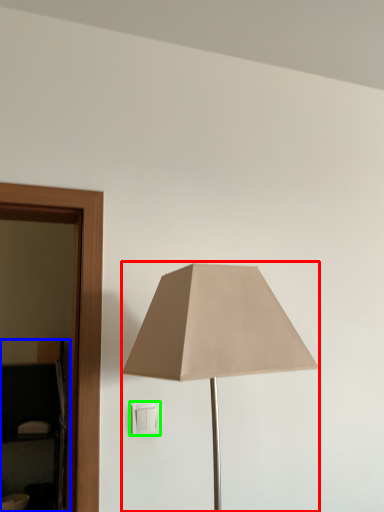
Question: Which object is the farthest from lamp (highlighted by a red box)? Choose among these: dresser (highlighted by a blue box) or light switch (highlighted by a green box).

Choices:
 (A) dresser
 (B) light switch

Answer: (A)